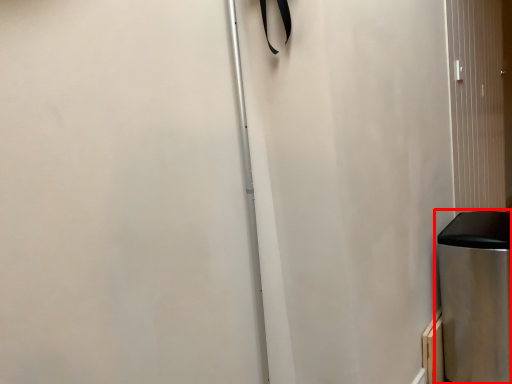
Question: From the image's perspective, where is waste container (annotated by the red box) located relative to screen door?

Choices:
 (A) below
 (B) above

Answer: (A)